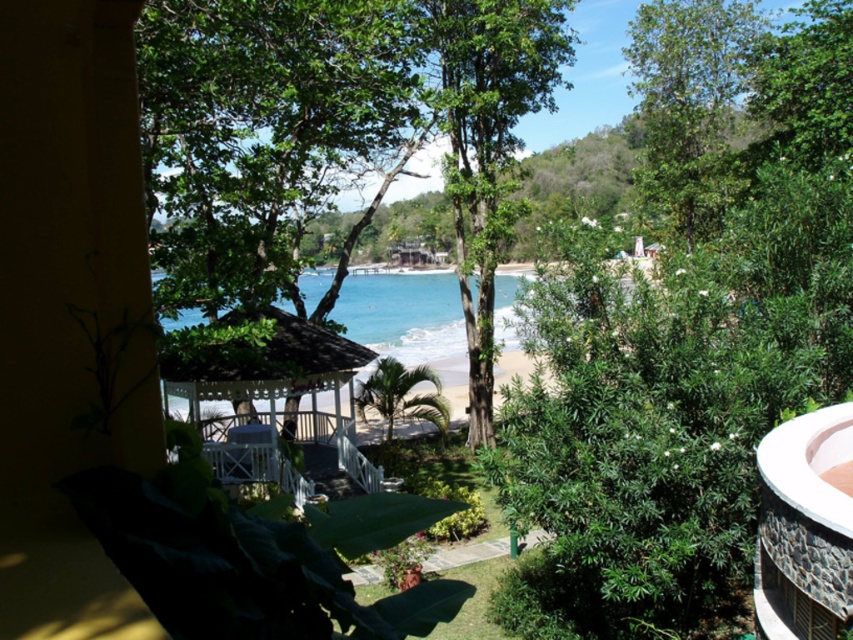
Question: Which is farther from the green leafy tree at center?

Choices:
 (A) white wooden gazebo at center
 (B) blue water at center
 (C) green leafy tree at upper right

Answer: (B)

Question: Does green leafy tree at upper right have a larger size compared to blue water at center?

Choices:
 (A) yes
 (B) no

Answer: (B)

Question: Estimate the real-world distances between objects in this image. Which object is farther from the blue water at center?

Choices:
 (A) green leafy tree at center
 (B) green leafy tree at upper right
 (C) white wooden gazebo at center

Answer: (B)

Question: Does green leafy tree at center appear on the left side of green leafy tree at upper right?

Choices:
 (A) yes
 (B) no

Answer: (A)

Question: Estimate the real-world distances between objects in this image. Which object is closer to the blue water at center?

Choices:
 (A) green leafy tree at center
 (B) green leafy tree at upper right

Answer: (A)

Question: Does green leafy tree at center appear on the right side of green leafy tree at upper right?

Choices:
 (A) no
 (B) yes

Answer: (A)